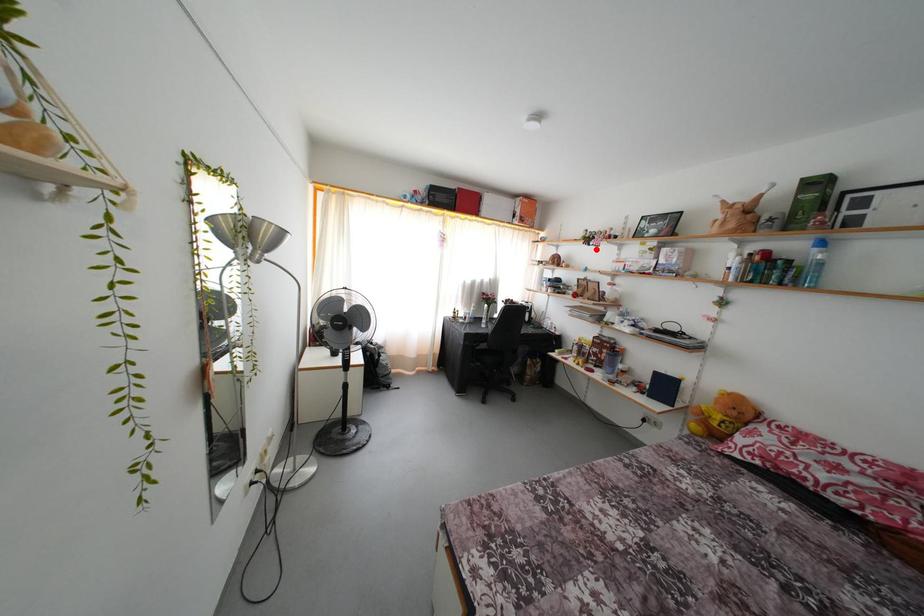
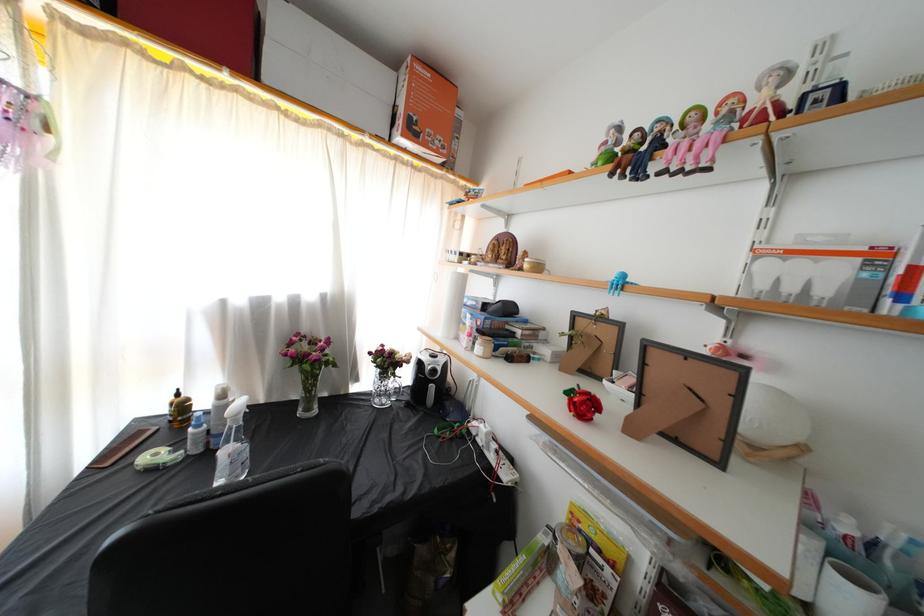
Where in the second image is the point corresponding to the highlighted location from the first image?

(659, 172)